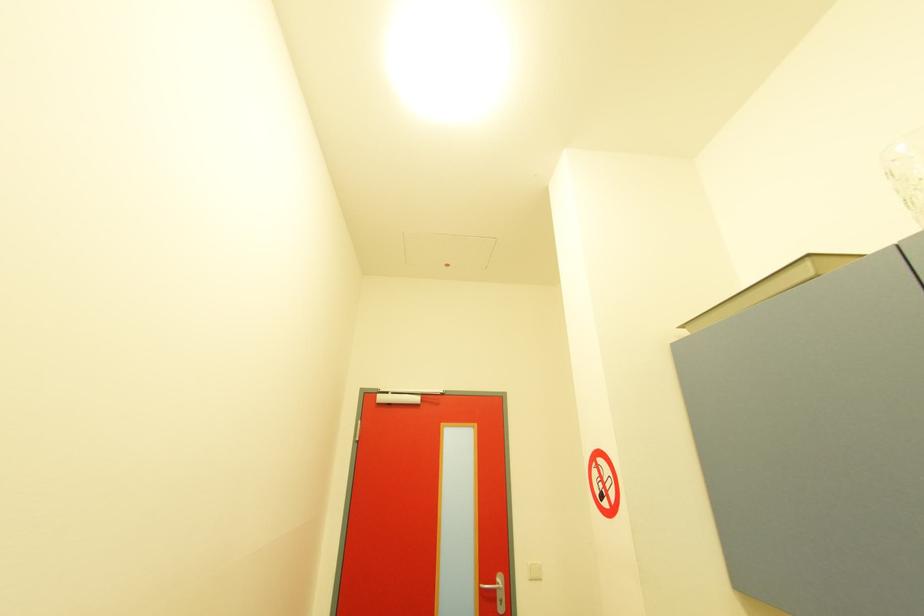
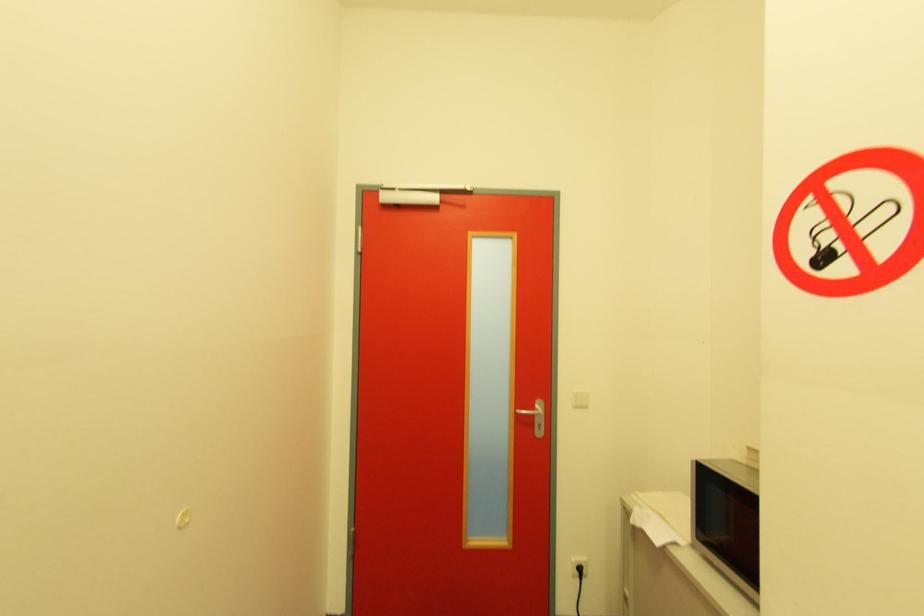
Question: The images are taken continuously from a first-person perspective. In which direction is your viewpoint rotating?

Choices:
 (A) Left
 (B) Right
 (C) Up
 (D) Down

Answer: (D)